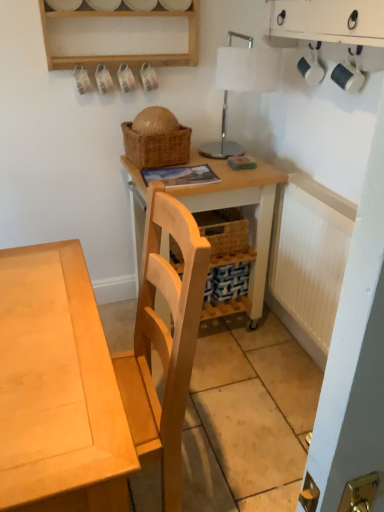
Question: From the image's perspective, is woven brown picnic basket at upper center located above or below wooden table at center?

Choices:
 (A) above
 (B) below

Answer: (A)

Question: In the image, is woven brown picnic basket at upper center on the left side or the right side of wooden table at center?

Choices:
 (A) right
 (B) left

Answer: (B)

Question: Which object is the farthest from the white ribbed radiator at right?

Choices:
 (A) white glossy table lamp at upper center
 (B) light wood desk at center
 (C) wooden table at center
 (D) woven brown picnic basket at upper center

Answer: (B)

Question: Considering the real-world distances, which object is farthest from the light wood desk at center?

Choices:
 (A) woven brown picnic basket at upper center
 (B) wooden table at center
 (C) white glossy table lamp at upper center
 (D) white ribbed radiator at right

Answer: (C)